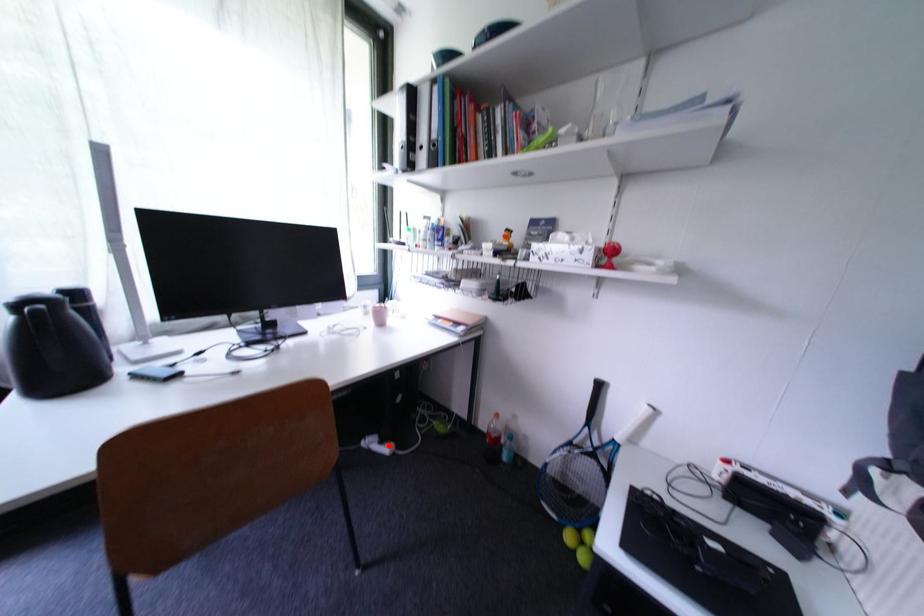
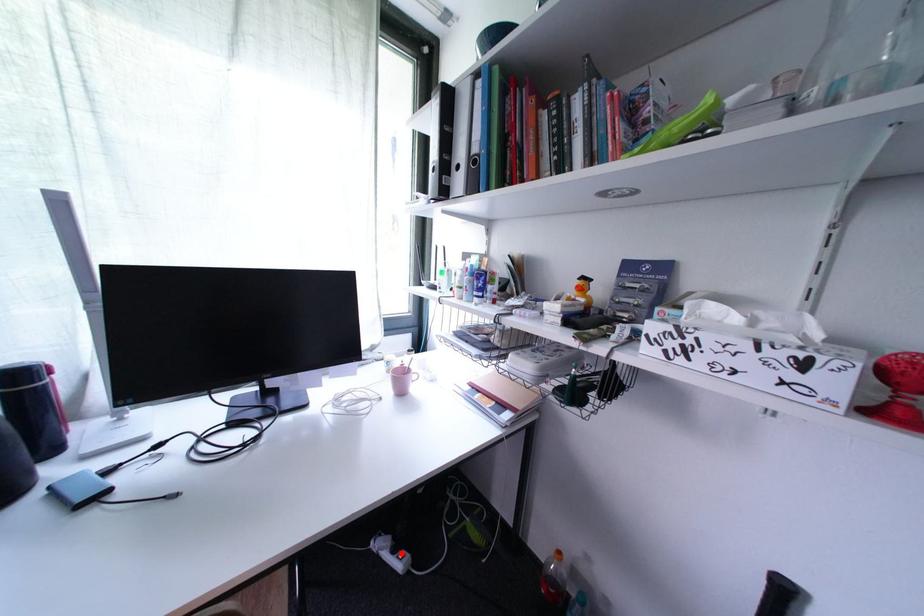
I am providing you with two images of the same scene from different viewpoints. A red point is marked on the first image and another point is marked on the second image. Are the points marked in image1 and image2 representing the same 3D position?

Yes